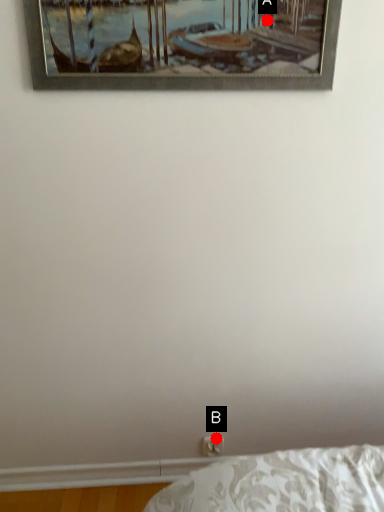
Question: Two points are circled on the image, labeled by A and B beside each circle. Which point is further to the camera?

Choices:
 (A) A is further
 (B) B is further

Answer: (B)